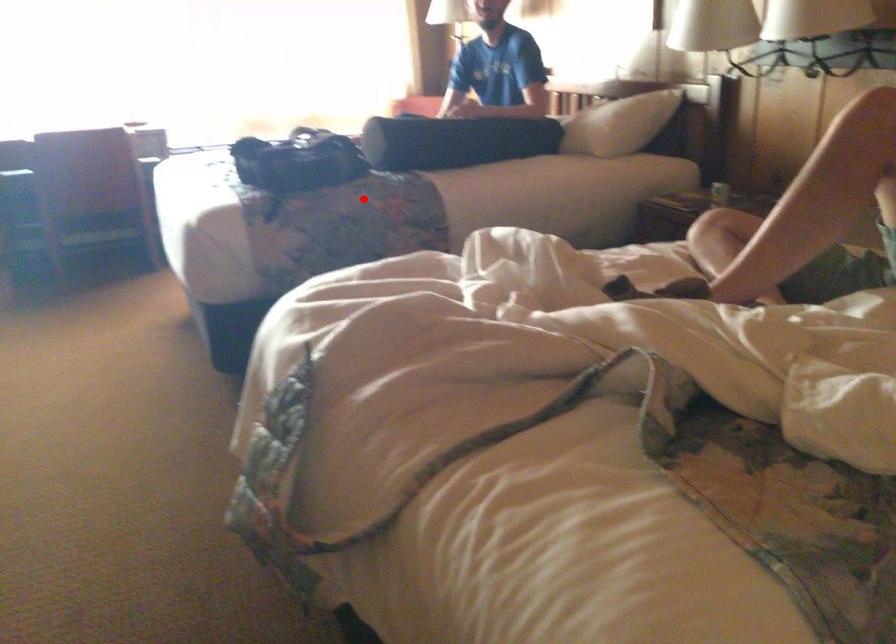
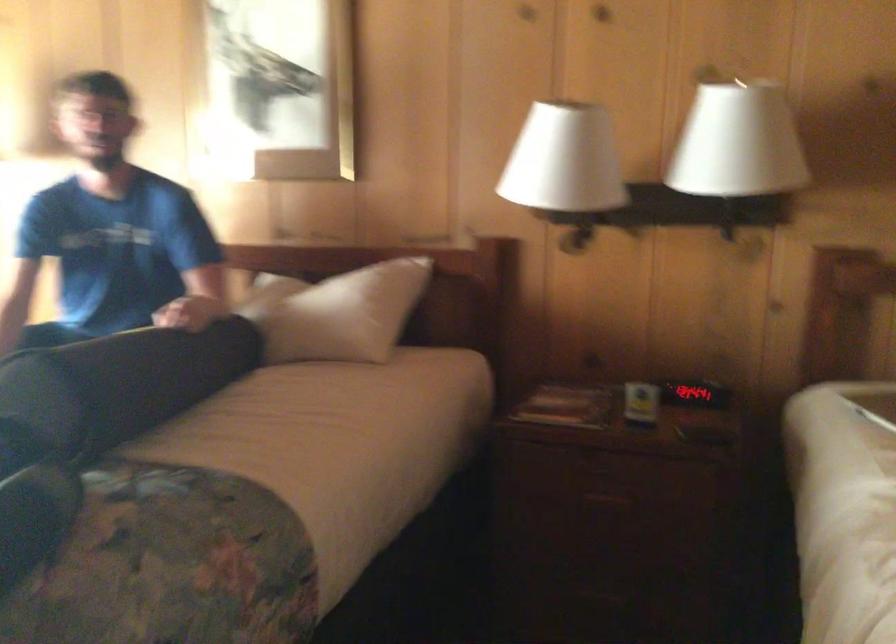
Question: I am providing you with two images of the same scene from different viewpoints. A red point is shown in image1. For the corresponding object point in image2, is it positioned nearer or farther from the camera?

Choices:
 (A) Nearer
 (B) Farther

Answer: (A)